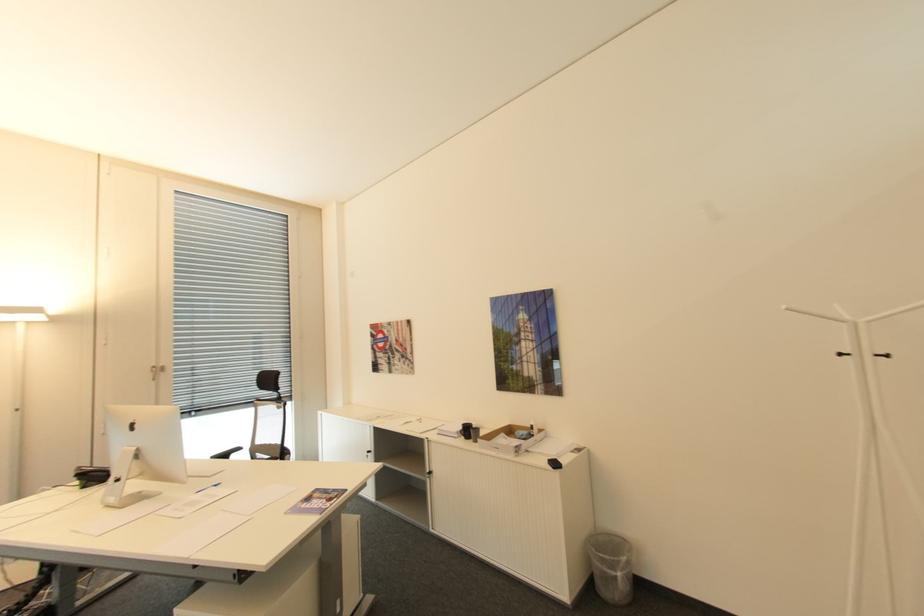
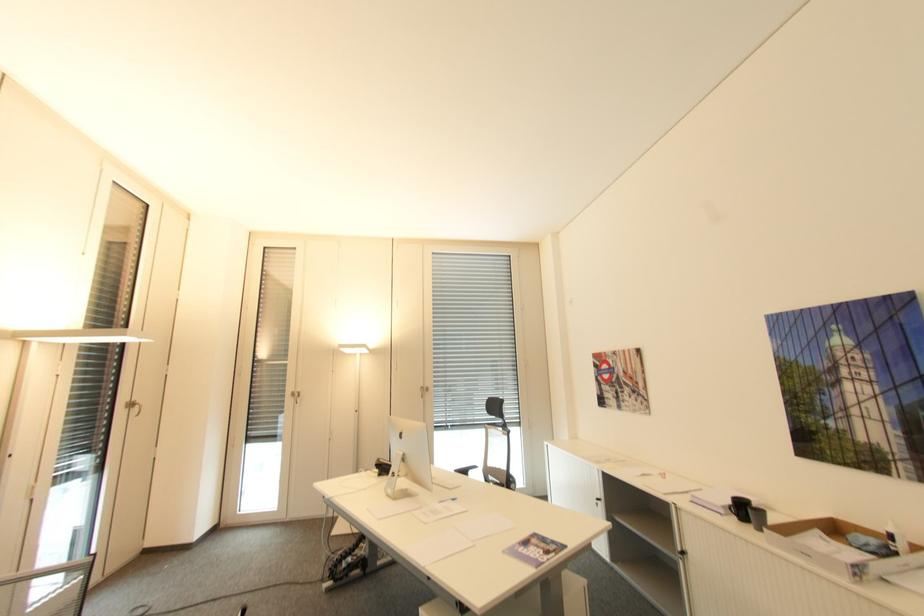
Locate, in the second image, the point that corresponds to [465,427] in the first image.

(734, 501)